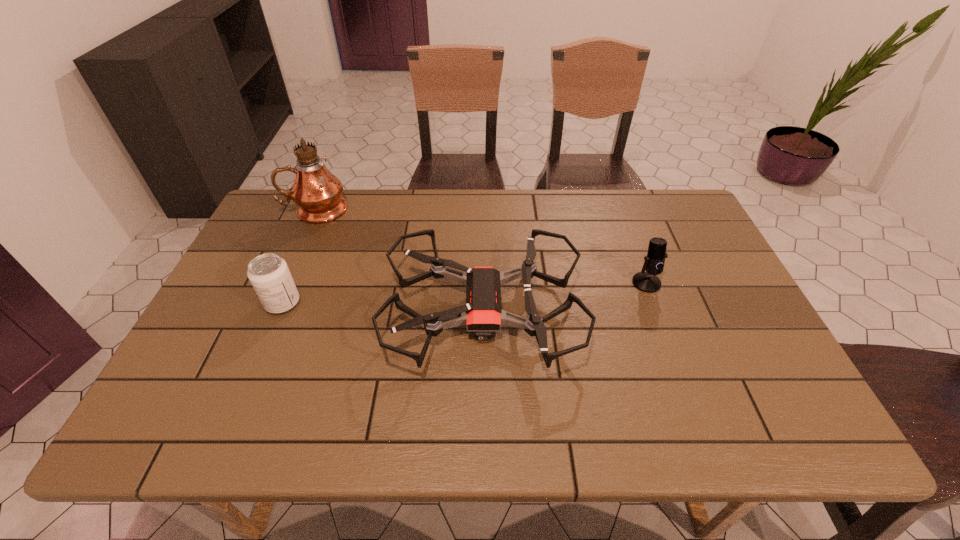
This screenshot has width=960, height=540. I want to click on oil lamp, so click(317, 192).

The width and height of the screenshot is (960, 540). What are the coordinates of `the tallest object` in the screenshot? It's located at (317, 192).

Locate an element on the screen. This screenshot has width=960, height=540. the rightmost object is located at coordinates (647, 281).

The image size is (960, 540). I want to click on soda can, so click(268, 273).

Image resolution: width=960 pixels, height=540 pixels. In order to click on the third object from left to right in this screenshot , I will do `click(482, 314)`.

Find the location of a particular element. drone is located at coordinates (482, 314).

This screenshot has height=540, width=960. I want to click on free space located 0.220m on the front of the tallest object, so click(x=287, y=273).

Where is `blank area located 0.180m on the stand of the rightmost object`? The height and width of the screenshot is (540, 960). blank area located 0.180m on the stand of the rightmost object is located at coordinates (671, 348).

The image size is (960, 540). I want to click on vacant position located on the back of the soda can, so click(x=313, y=231).

Find the location of `vacant area situated with the camera facing forward on the shortest object`. vacant area situated with the camera facing forward on the shortest object is located at coordinates (233, 312).